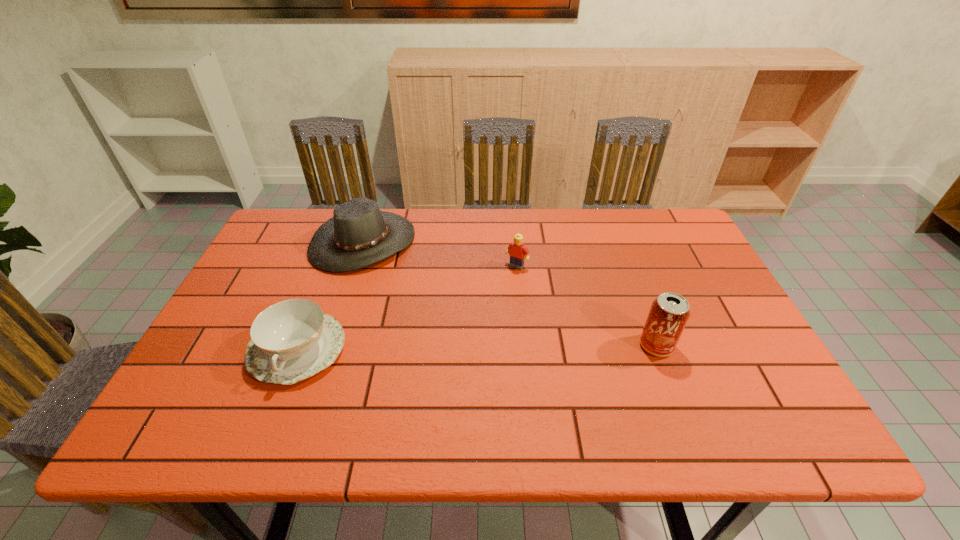
Find the location of a particular element. vacant space at the right edge of the desktop is located at coordinates (702, 356).

Image resolution: width=960 pixels, height=540 pixels. I want to click on vacant space at the far left corner, so click(x=308, y=244).

Where is `vacant position at the near left corner of the desktop`? Image resolution: width=960 pixels, height=540 pixels. vacant position at the near left corner of the desktop is located at coordinates (235, 392).

In the image, there is a desktop. What are the coordinates of `vacant space at the far right corner` in the screenshot? It's located at (660, 222).

This screenshot has height=540, width=960. I want to click on free spot between the second object from right to left and the hat, so click(440, 253).

In order to click on vacant area that lies between the hat and the tallest object in this screenshot , I will do `click(510, 294)`.

At what (x,y) coordinates should I click in order to perform the action: click on empty location between the third object from left to right and the soda can. Please return your answer as a coordinate pair (x, y). Looking at the image, I should click on (587, 306).

Where is `empty space between the hat and the shortest object`? empty space between the hat and the shortest object is located at coordinates (330, 295).

Identify the location of free space between the Lego and the hat. (440, 253).

Find the location of a particular element. The width and height of the screenshot is (960, 540). vacant area that lies between the rightmost object and the shortest object is located at coordinates (477, 347).